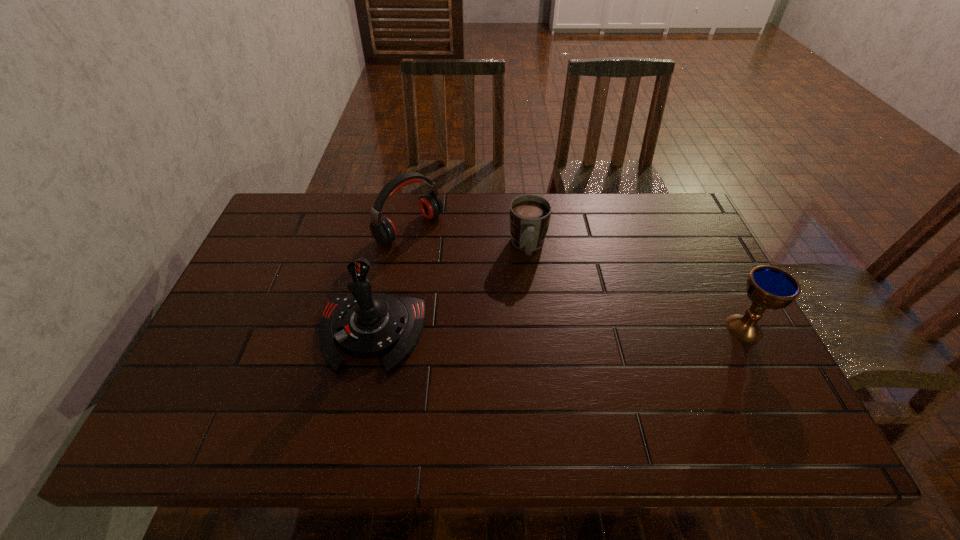
Locate an element on the screen. This screenshot has height=540, width=960. vacant space on the desktop that is between the joystick and the chalice and is positioned on the ear cups of the earphone is located at coordinates (544, 331).

Locate an element on the screen. This screenshot has height=540, width=960. free space on the desktop that is between the joystick and the rightmost object and is positioned on the side of the third object from left to right with the handle is located at coordinates (529, 332).